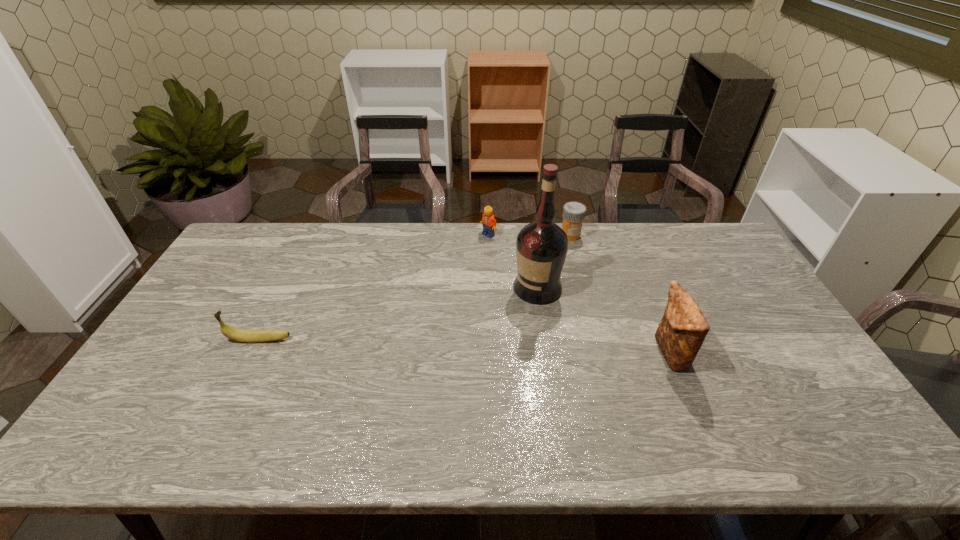
Image resolution: width=960 pixels, height=540 pixels. What are the coordinates of `free point located 0.180m on the front-facing side of the Lego` in the screenshot? It's located at (465, 268).

In order to click on medicine that is at the far edge in this screenshot , I will do `click(573, 215)`.

At what (x,y) coordinates should I click in order to perform the action: click on Lego present at the far edge. Please return your answer as a coordinate pair (x, y). Image resolution: width=960 pixels, height=540 pixels. Looking at the image, I should click on (489, 223).

Identify the location of vacant space at the far edge of the desktop. The width and height of the screenshot is (960, 540). (581, 250).

Find the location of `vacant area at the near edge`. vacant area at the near edge is located at coordinates (618, 386).

In the image, there is a desktop. Identify the location of free region at the left edge. The width and height of the screenshot is (960, 540). (217, 268).

You are a GUI agent. You are given a task and a screenshot of the screen. Output one action in this format:
    pyautogui.click(x=<x>, y=<y>)
    Task: Click on the vacant space at the right edge of the desktop
    
    Given the screenshot: What is the action you would take?
    pyautogui.click(x=752, y=283)

You are a GUI agent. You are given a task and a screenshot of the screen. Output one action in this format:
    pyautogui.click(x=<x>, y=<y>)
    Task: Click on the free space at the far left corner of the desktop
    The image size is (960, 540).
    Given the screenshot: What is the action you would take?
    pyautogui.click(x=278, y=231)

You are a GUI agent. You are given a task and a screenshot of the screen. Output one action in this format:
    pyautogui.click(x=<x>, y=<y>)
    Task: Click on the vacant space at the far right corner
    
    Given the screenshot: What is the action you would take?
    pyautogui.click(x=684, y=241)

Where is `blank region between the second tallest object and the Lego`? blank region between the second tallest object and the Lego is located at coordinates (579, 294).